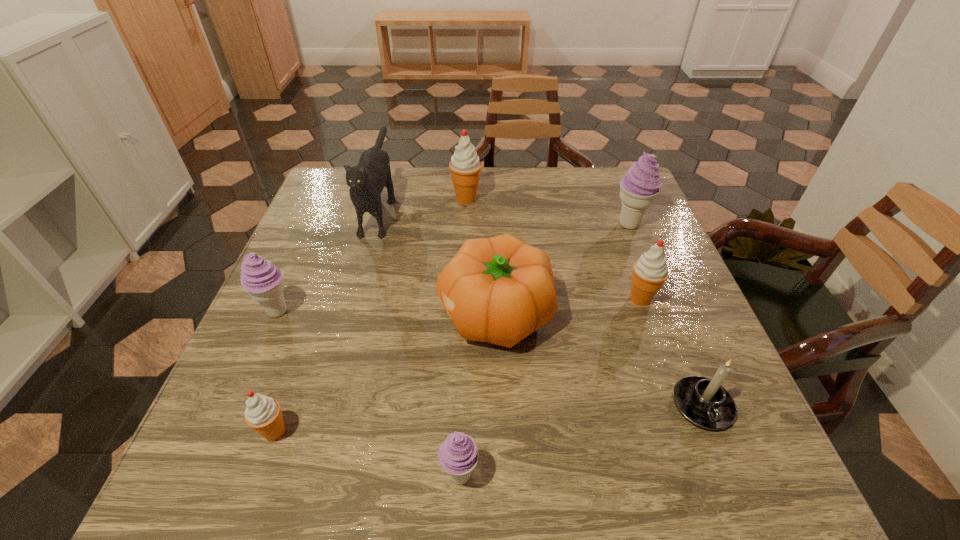
I want to click on the leftmost purple icecream, so click(260, 278).

I want to click on candle holder, so click(x=704, y=402).

Identify the location of the smallest red icecream. The width and height of the screenshot is (960, 540). (263, 414).

Locate an element on the screen. the second icecream from left to right is located at coordinates (263, 414).

This screenshot has width=960, height=540. What are the coordinates of `the smallest purple icecream` in the screenshot? It's located at (458, 455).

This screenshot has height=540, width=960. I want to click on the nearest icecream, so click(x=458, y=455).

Identify the location of blank area located 0.060m on the front-facing side of the cat. This screenshot has height=540, width=960. (363, 266).

Locate an element on the screen. This screenshot has height=540, width=960. vacant space located 0.130m on the front of the farthest icecream is located at coordinates (465, 237).

In order to click on vacant space located 0.330m on the left of the biggest purple icecream in this screenshot , I will do `click(488, 224)`.

Identify the location of free region located 0.360m on the carved face of the pumpkin. The height and width of the screenshot is (540, 960). (271, 314).